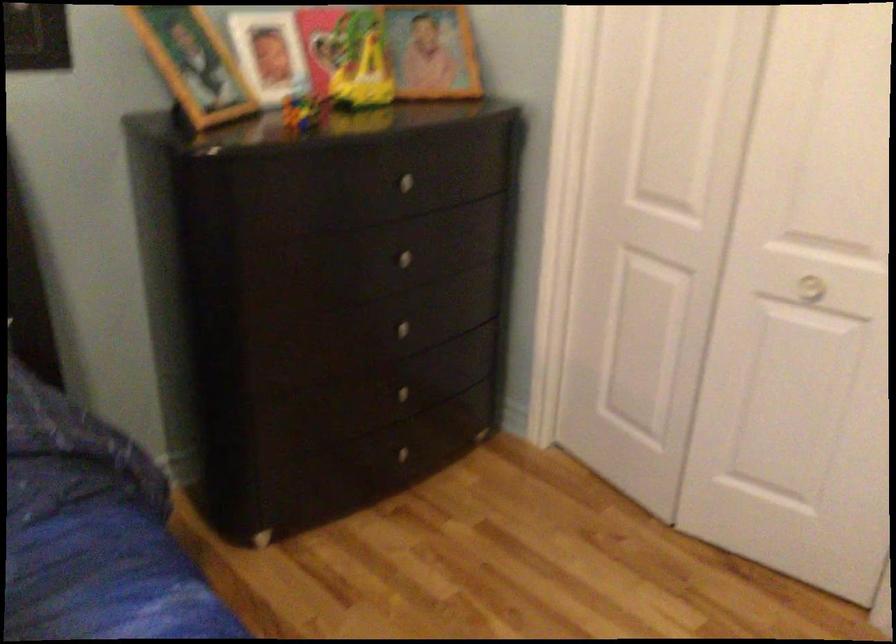
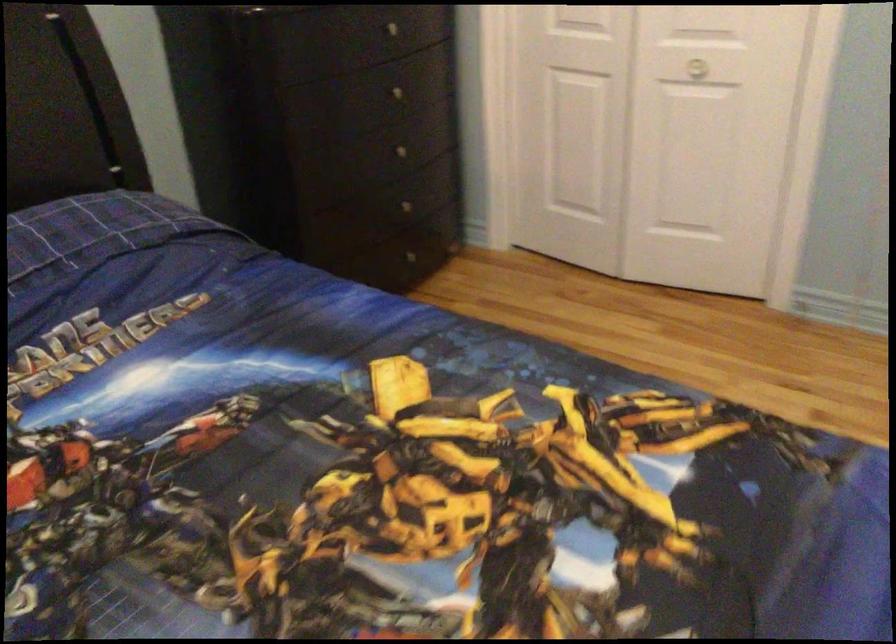
Question: Based on the continuous images, in which direction is the camera rotating? Reply with the corresponding letter.

Choices:
 (A) Left
 (B) Right
 (C) Up
 (D) Down

Answer: (B)